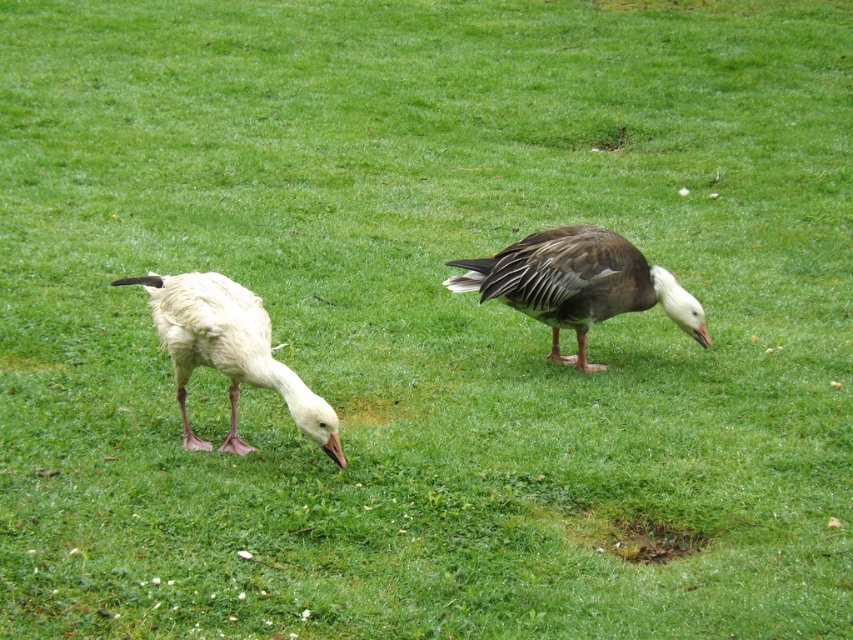
Consider the image. You are a birdwatcher observing two birds in the image. You see a brown feathered duck at center and a white matte goose at left. Which bird is positioned higher in the image?

The brown feathered duck at center is positioned higher than the white matte goose at left in the image.

You are standing at the origin point in the image. Which direction should you move to reach the brown feathered duck at center?

The brown feathered duck at center is located at point (577, 284), so you should move towards the right and forward to reach it.